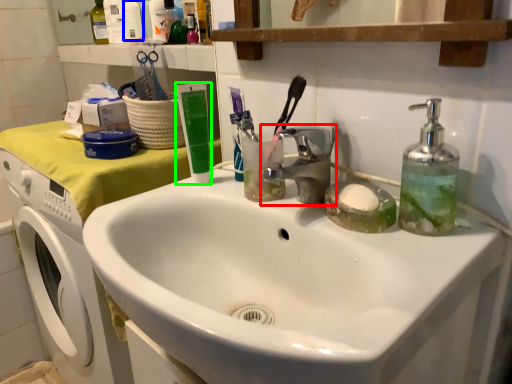
Question: Based on their relative distances, which object is farther from tap (highlighted by a red box)? Choose from toiletry (highlighted by a blue box) and toothpaste (highlighted by a green box).

Choices:
 (A) toiletry
 (B) toothpaste

Answer: (A)